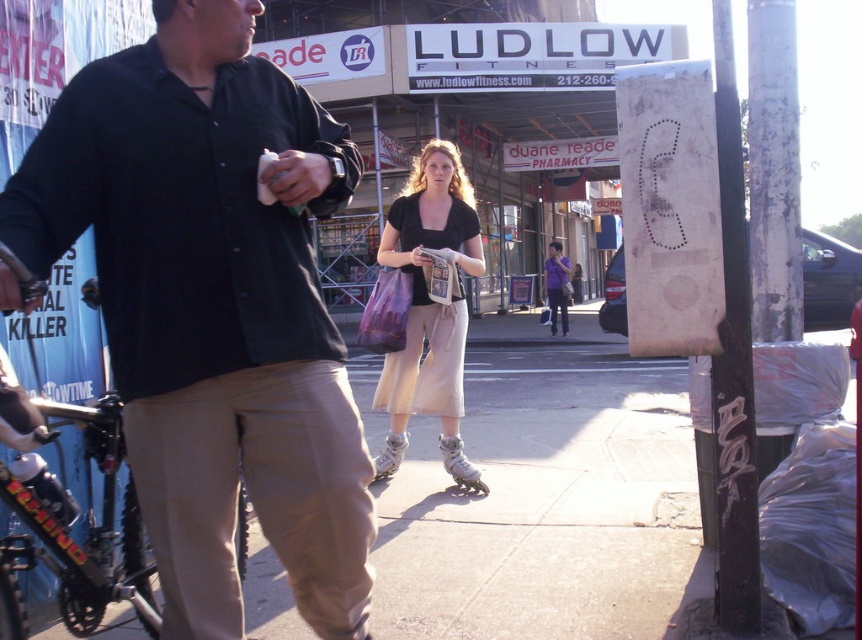
Question: Does khaki cotton pants at lower center have a smaller size compared to matte black shirt at center?

Choices:
 (A) no
 (B) yes

Answer: (B)

Question: Is light brown concrete sidewalk at center above khaki cotton pants at lower center?

Choices:
 (A) yes
 (B) no

Answer: (B)

Question: Which object is the closest to the matte black shirt at center?

Choices:
 (A) matte black hand at center
 (B) black painted metal pole at right

Answer: (B)

Question: Which of the following is the farthest from the observer?

Choices:
 (A) matte black shirt at center
 (B) matte black hand at center
 (C) khaki cotton pants at lower center
 (D) matte black handbag at center

Answer: (D)

Question: Which point is closer to the camera?

Choices:
 (A) khaki cotton pants at lower center
 (B) matte black shirt at center

Answer: (A)

Question: Is black painted metal pole at right to the right of matte black handbag at center from the viewer's perspective?

Choices:
 (A) yes
 (B) no

Answer: (A)